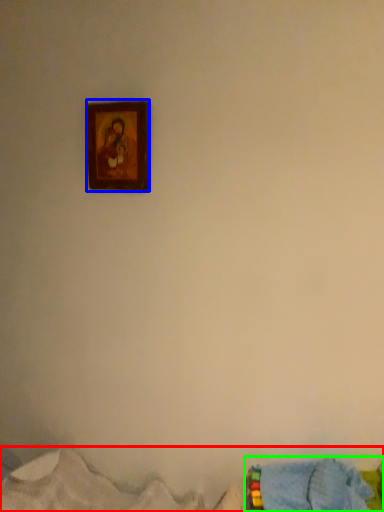
Question: Which object is positioned closest to bed (highlighted by a red box)? Select from picture frame (highlighted by a blue box) and bed (highlighted by a green box).

Choices:
 (A) picture frame
 (B) bed

Answer: (B)